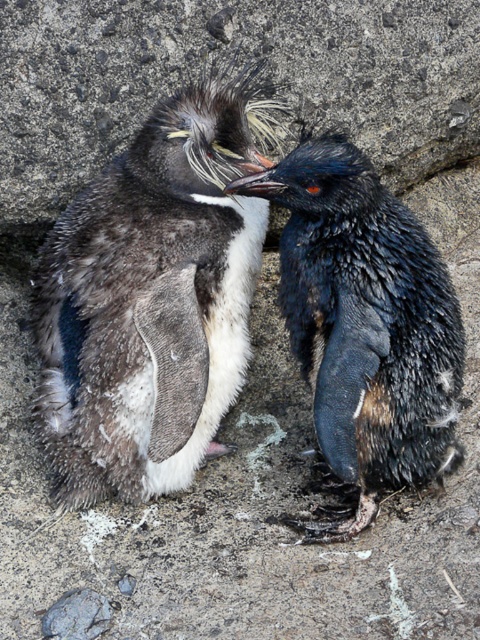
Can you confirm if dark brown fluffy penguin at center is smaller than shiny black penguin at right?

No.

Between dark brown fluffy penguin at center and shiny black penguin at right, which one has more height?

dark brown fluffy penguin at center

From the picture: Who is more forward, (127, 353) or (325, 536)?

Point (127, 353)

Where is `dark brown fluffy penguin at center`? The image size is (480, 640). dark brown fluffy penguin at center is located at coordinates (153, 298).